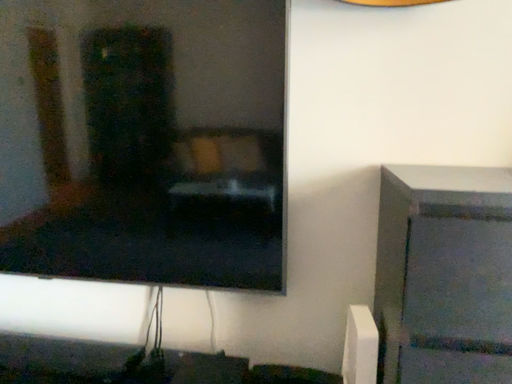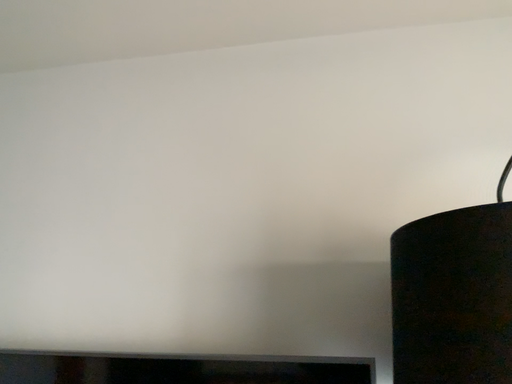
Question: How did the camera likely rotate when shooting the video?

Choices:
 (A) rotated downward
 (B) rotated upward

Answer: (B)